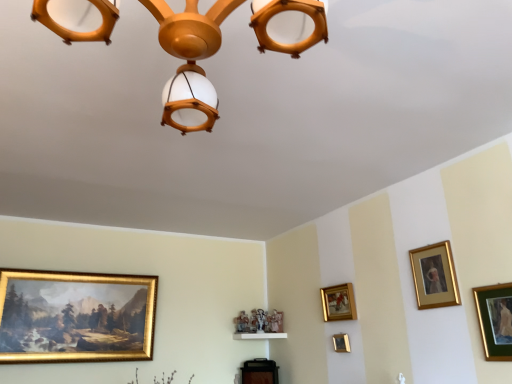
Question: Considering the positions of point (123, 297) and point (347, 349), is point (123, 297) closer or farther from the camera than point (347, 349)?

Choices:
 (A) closer
 (B) farther

Answer: (B)

Question: From a real-world perspective, is gold/gilded picture frame at lower left, the 3th picture frame in the back-to-front sequence, above or below gold/gilded picture frame at lower center, placed as the third picture frame when sorted from right to left?

Choices:
 (A) above
 (B) below

Answer: (A)

Question: Estimate the real-world distances between objects in this image. Which object is closer to the green matte picture frame at right, which is the first picture frame in right-to-left order?

Choices:
 (A) gold/gilded picture frame at center-right, positioned as the 4th picture frame in right-to-left order
 (B) gold/gilded picture frame at lower left, the 1th picture frame positioned from the left
 (C) gold/gilded picture frame at lower center, placed as the third picture frame when sorted from right to left
 (D) wooden chandelier at upper center
 (E) gold/golden picture frame at upper right, which is counted as the second picture frame, starting from the right

Answer: (E)

Question: Estimate the real-world distances between objects in this image. Which object is farther from the wooden chandelier at upper center?

Choices:
 (A) green matte picture frame at right, which is the first picture frame in right-to-left order
 (B) gold/gilded picture frame at center-right, the second picture frame in the back-to-front sequence
 (C) gold/gilded picture frame at lower center, the first picture frame when ordered from back to front
 (D) gold/golden picture frame at upper right, placed as the fourth picture frame when sorted from left to right
 (E) gold/gilded picture frame at lower left, the 1th picture frame positioned from the left

Answer: (E)